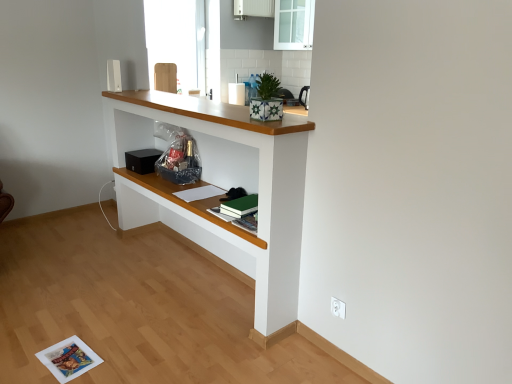
Question: Is white plastic electric outlet at lower right closer to camera compared to white glossy cabinet at upper center?

Choices:
 (A) no
 (B) yes

Answer: (B)

Question: Can you confirm if white plastic electric outlet at lower right is bigger than white glossy cabinet at upper center?

Choices:
 (A) no
 (B) yes

Answer: (A)

Question: Is white plastic electric outlet at lower right at the left side of white glossy cabinet at upper center?

Choices:
 (A) yes
 (B) no

Answer: (B)

Question: From the image's perspective, does white plastic electric outlet at lower right appear lower than white glossy cabinet at upper center?

Choices:
 (A) no
 (B) yes

Answer: (B)

Question: Does white plastic electric outlet at lower right have a lesser width compared to white glossy cabinet at upper center?

Choices:
 (A) yes
 (B) no

Answer: (A)

Question: Is white plastic electric outlet at lower right taller or shorter than black matte speaker at center?

Choices:
 (A) short
 (B) tall

Answer: (A)

Question: From the image's perspective, is white plastic electric outlet at lower right above or below black matte speaker at center?

Choices:
 (A) above
 (B) below

Answer: (B)

Question: Is white plastic electric outlet at lower right inside the boundaries of black matte speaker at center, or outside?

Choices:
 (A) outside
 (B) inside

Answer: (A)

Question: In terms of size, does white plastic electric outlet at lower right appear bigger or smaller than black matte speaker at center?

Choices:
 (A) small
 (B) big

Answer: (A)

Question: Is transparent glass cabinet at upper center wider or thinner than white painted wood shelf at center?

Choices:
 (A) thin
 (B) wide

Answer: (A)

Question: Does point (291, 1) appear closer or farther from the camera than point (129, 183)?

Choices:
 (A) closer
 (B) farther

Answer: (B)

Question: Considering their positions, is transparent glass cabinet at upper center located in front of or behind white painted wood shelf at center?

Choices:
 (A) behind
 (B) front

Answer: (A)

Question: From a real-world perspective, is transparent glass cabinet at upper center physically located above or below white painted wood shelf at center?

Choices:
 (A) above
 (B) below

Answer: (A)

Question: Looking at the image, does white painted wood shelf at center seem bigger or smaller compared to transparent glass cabinet at upper center?

Choices:
 (A) big
 (B) small

Answer: (A)

Question: Is point (108, 127) closer or farther from the camera than point (290, 19)?

Choices:
 (A) farther
 (B) closer

Answer: (B)